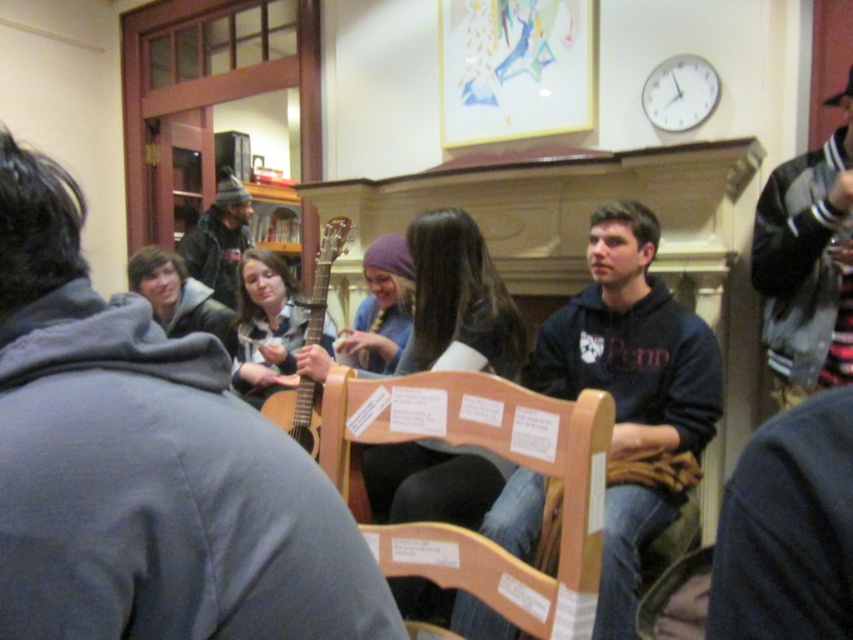
Who is taller, wooden chair at center or matte brown guitar at center?

matte brown guitar at center is taller.

Is wooden chair at center further to the viewer compared to matte brown guitar at center?

No, wooden chair at center is closer to the viewer.

Where is `wooden chair at center`? The width and height of the screenshot is (853, 640). wooden chair at center is located at coordinates (498, 452).

Identify the location of matte black guitar at center. The image size is (853, 640). tap(148, 465).

Identify the location of matte black guitar at center. (148, 465).

This screenshot has height=640, width=853. Find the location of `matte black guitar at center`. matte black guitar at center is located at coordinates click(x=148, y=465).

Measure the distance between matte black guitar at center and camera.

A distance of 18.06 inches exists between matte black guitar at center and camera.

Who is positioned more to the right, matte black guitar at center or wooden chair at center?

wooden chair at center is more to the right.

At what (x,y) coordinates should I click in order to perform the action: click on matte black guitar at center. Please return your answer as a coordinate pair (x, y). Looking at the image, I should click on (148, 465).